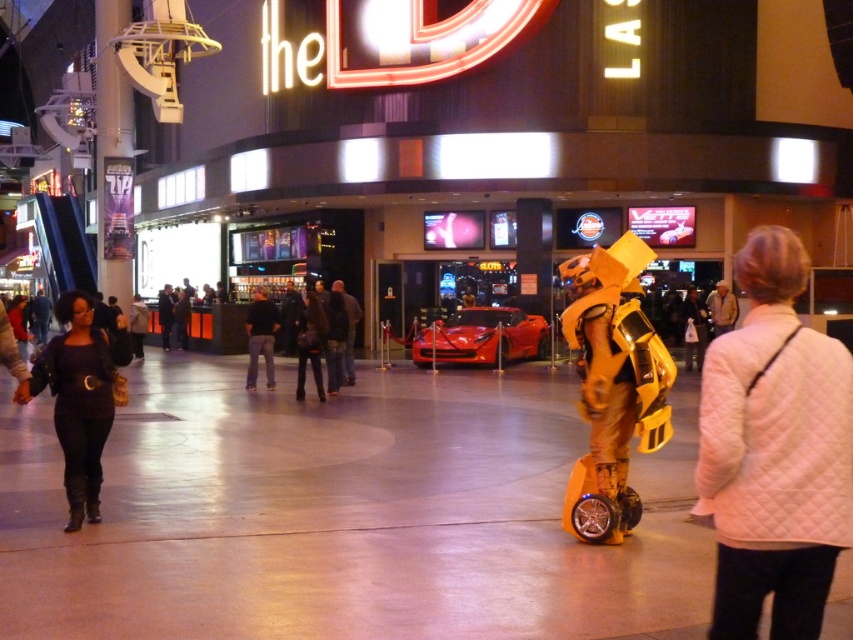
Which is above, white quilted jacket at lower right or yellow matte scooter at center?

yellow matte scooter at center

Is point (825, 388) positioned after point (601, 266)?

No, it is not.

Who is more forward, [738,579] or [612,410]?

Point [738,579] is more forward.

The width and height of the screenshot is (853, 640). What are the coordinates of `white quilted jacket at lower right` in the screenshot? It's located at (775, 451).

Is white quilted jacket at lower right smaller than shiny red car at center?

Correct, white quilted jacket at lower right occupies less space than shiny red car at center.

Is point (817, 509) farther from viewer compared to point (421, 332)?

No, (817, 509) is closer to viewer.

This screenshot has width=853, height=640. Describe the element at coordinates (775, 451) in the screenshot. I see `white quilted jacket at lower right` at that location.

This screenshot has height=640, width=853. What are the coordinates of `white quilted jacket at lower right` in the screenshot? It's located at (775, 451).

Between black leather jacket at left and shiny red car at center, which one has less height?

Standing shorter between the two is shiny red car at center.

Can you confirm if black leather jacket at left is positioned to the right of shiny red car at center?

In fact, black leather jacket at left is to the left of shiny red car at center.

Where is `black leather jacket at left`? black leather jacket at left is located at coordinates (79, 397).